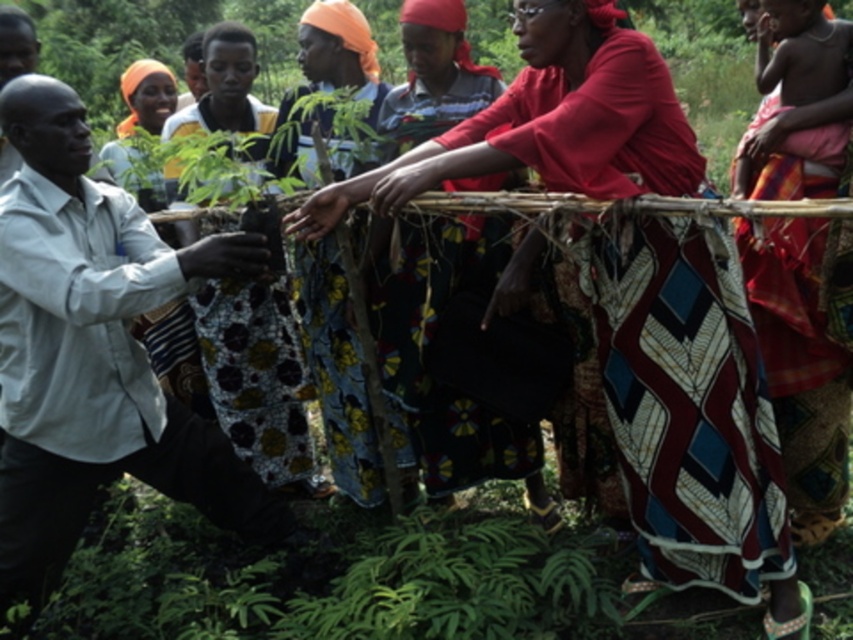
You are part of a group of people in a garden. You see a red woven cloth at center and a light gray shirt at left. Which object is positioned to the right of the other?

The red woven cloth at center is to the right of the light gray shirt at left.

You are a photographer taking a picture of the scene. You want to focus on the red woven cloth at center and the light gray shirt at left. Which object should you adjust your camera focus to first to ensure both are in focus?

The red woven cloth at center is closer to the viewer than the light gray shirt at left. To ensure both are in focus, you should focus on the red woven cloth at center first, as it is closer, and the light gray shirt at left will naturally fall into focus if the depth of field is sufficient.